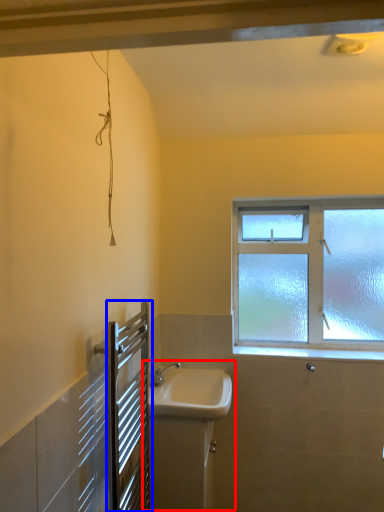
Question: Which point is further to the camera, sink (highlighted by a red box) or screen door (highlighted by a blue box)?

Choices:
 (A) sink
 (B) screen door

Answer: (A)